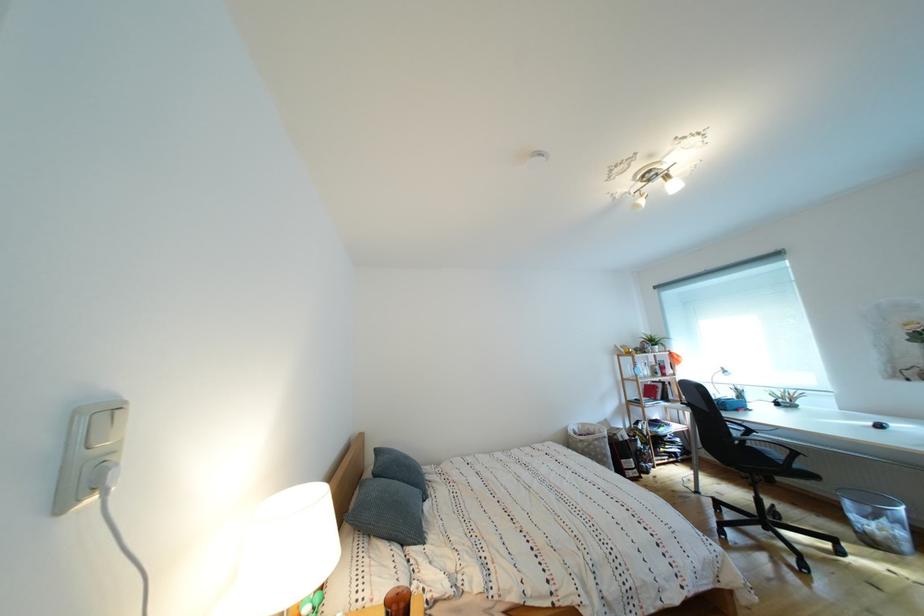
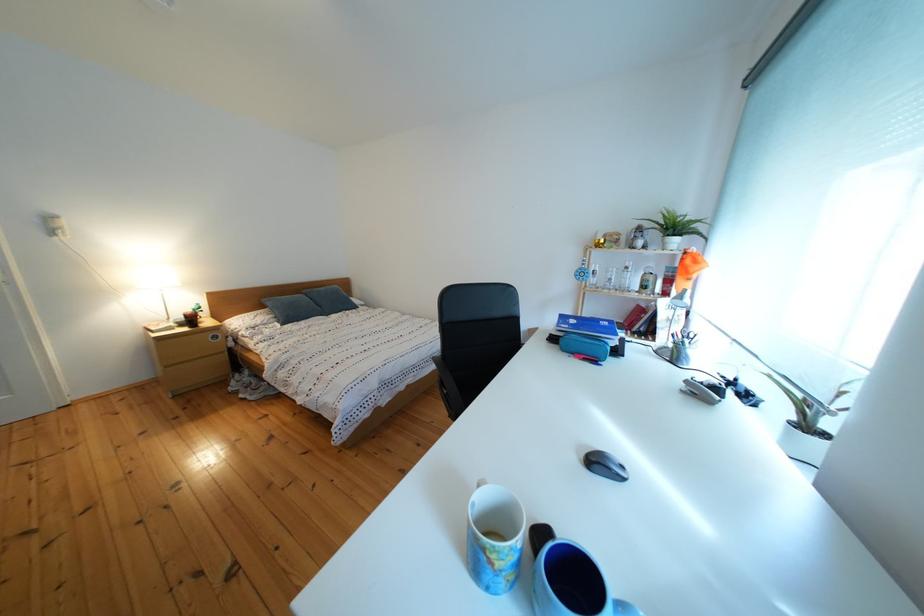
Question: I am providing you with two images of the same scene from different viewpoints. Please identify which objects are invisible in image2.

Choices:
 (A) chair armrest
 (B) cardboard detergent box
 (C) black computer mouse
 (D) clear glass bottle

Answer: (A)